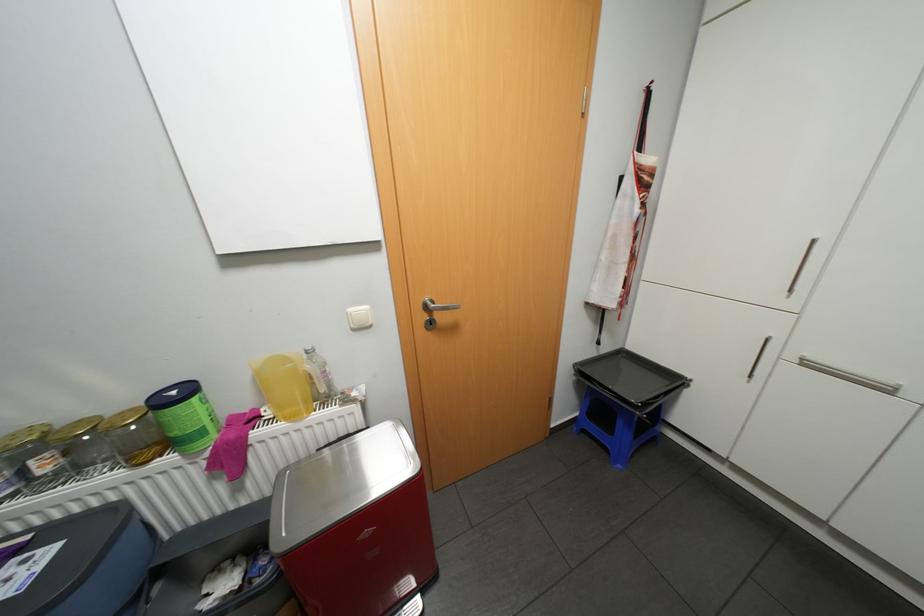
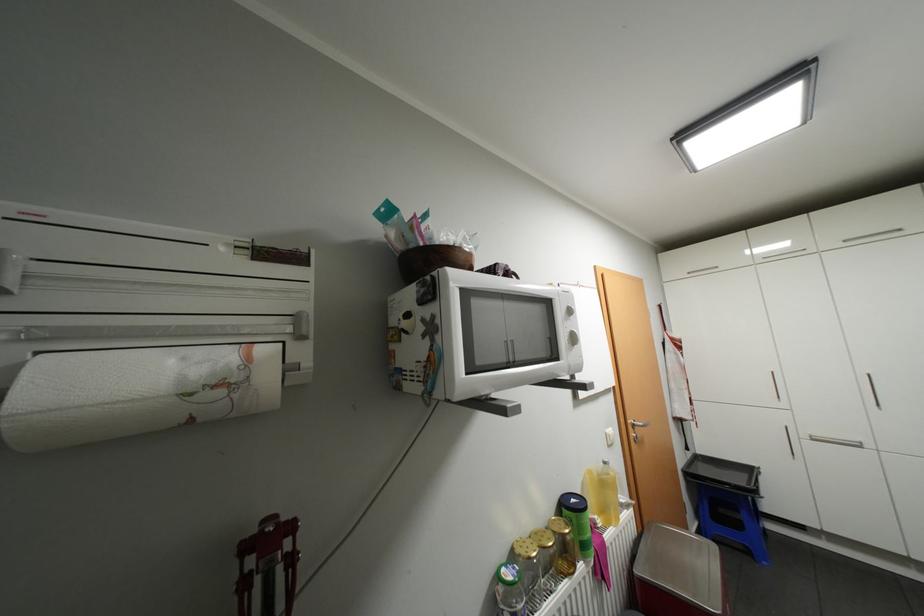
Find the pixel in the second image that matches the point at 183,391 in the first image.

(580, 499)